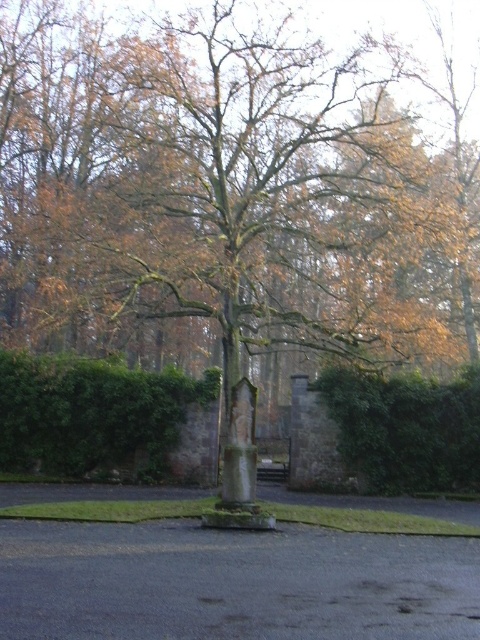
Question: Does green leafy hedge at center appear on the right side of green leafy hedge at right?

Choices:
 (A) yes
 (B) no

Answer: (B)

Question: Is green leafy hedge at center above green leafy hedge at right?

Choices:
 (A) no
 (B) yes

Answer: (B)

Question: Is green leafy hedge at center above green leafy hedge at right?

Choices:
 (A) no
 (B) yes

Answer: (B)